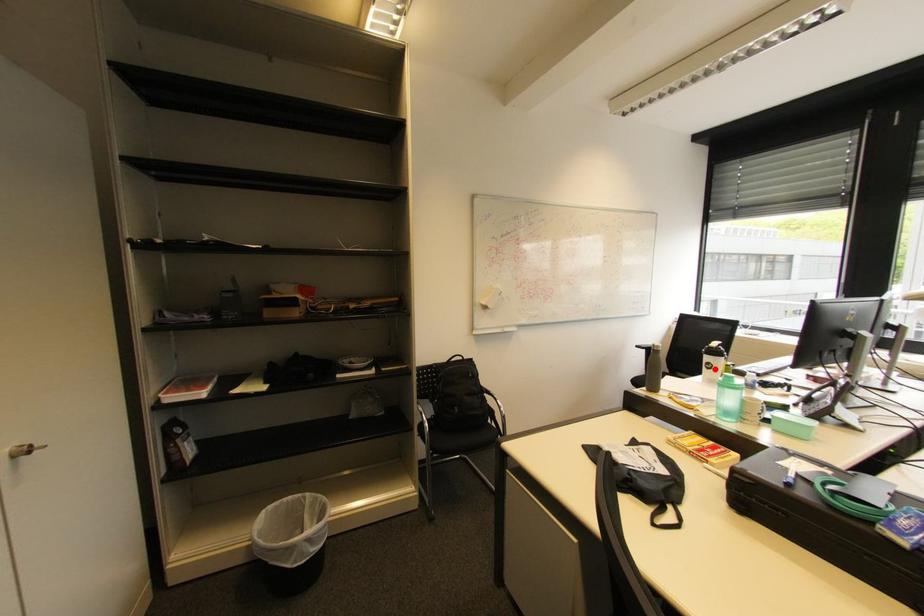
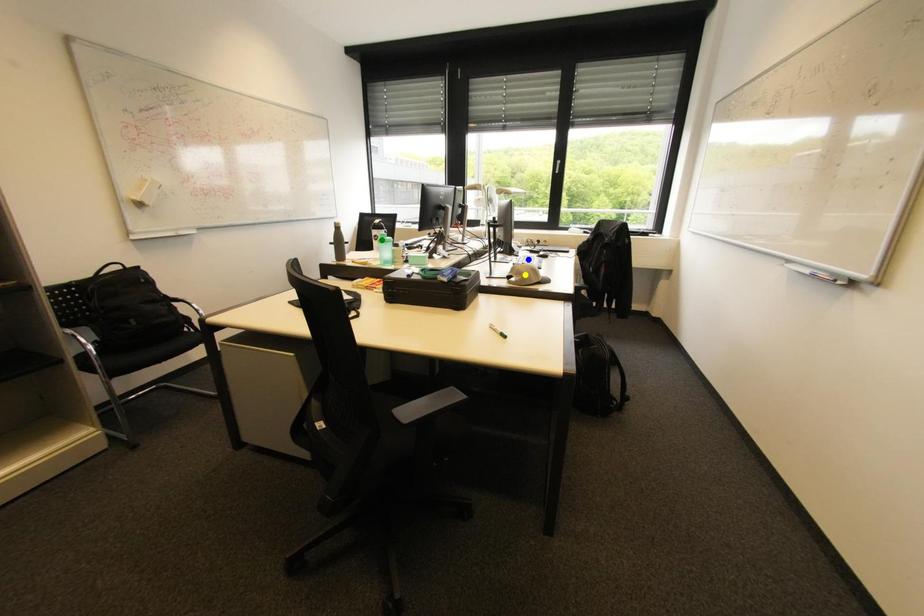
Question: I am providing you with two images of the same scene from different viewpoints. A red point is marked on the first image. You are given multiple points on the second image. Which point in image 2 is actually the same real-world point as the red point in image 1?

Choices:
 (A) blue point
 (B) yellow point
 (C) green point

Answer: (C)